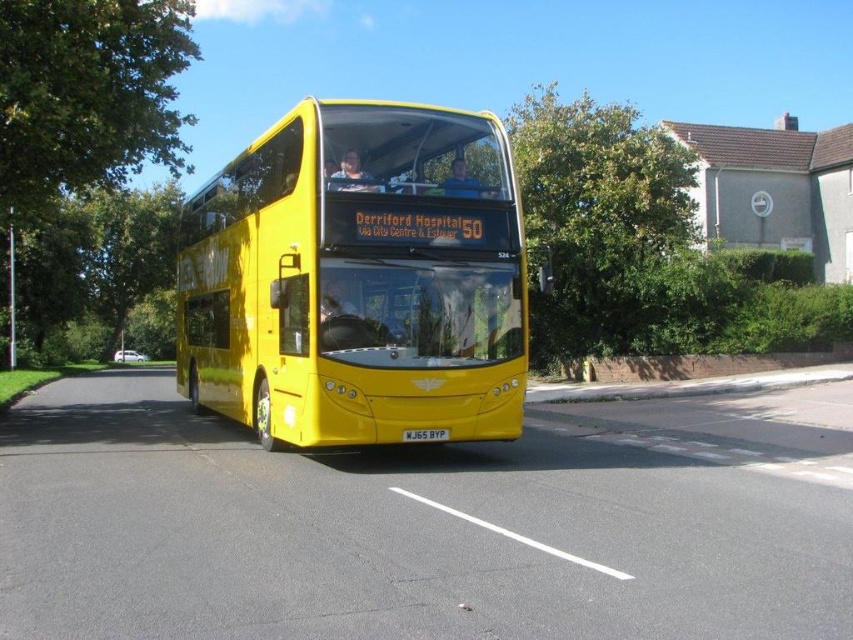
Consider the image. Is yellow matte/decorative bus at center closer to the viewer compared to green leafy tree at left?

Yes, it is.

Locate an element on the screen. yellow matte/decorative bus at center is located at coordinates (357, 278).

Does green leafy tree at left come behind yellow matte license plate at center?

Yes, green leafy tree at left is behind yellow matte license plate at center.

Does green leafy tree at left appear over yellow matte license plate at center?

Indeed, green leafy tree at left is positioned over yellow matte license plate at center.

What do you see at coordinates (86, 164) in the screenshot? I see `green leafy tree at left` at bounding box center [86, 164].

Identify the location of green leafy tree at left. The width and height of the screenshot is (853, 640). (86, 164).

Which is more to the right, yellow matte/decorative bus at center or green leafy tree at upper center?

From the viewer's perspective, green leafy tree at upper center appears more on the right side.

Who is more distant from viewer, (212, 340) or (706, 284)?

The point (706, 284) is more distant.

You are a GUI agent. You are given a task and a screenshot of the screen. Output one action in this format:
    pyautogui.click(x=<x>, y=<y>)
    Task: Click on the yellow matte/decorative bus at center
    
    Given the screenshot: What is the action you would take?
    pyautogui.click(x=357, y=278)